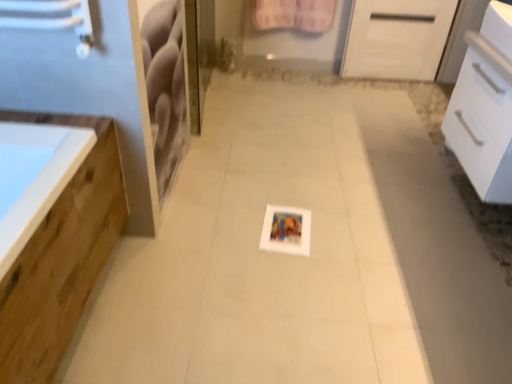
Describe the element at coordinates (485, 107) in the screenshot. I see `white glossy cabinet at right` at that location.

The height and width of the screenshot is (384, 512). I want to click on white glossy cabinet at right, so click(485, 107).

You are a GUI agent. You are given a task and a screenshot of the screen. Output one action in this format:
    pyautogui.click(x=<x>, y=<y>)
    Task: Click on the white glossy cabinet at right
    
    Given the screenshot: What is the action you would take?
    pyautogui.click(x=485, y=107)